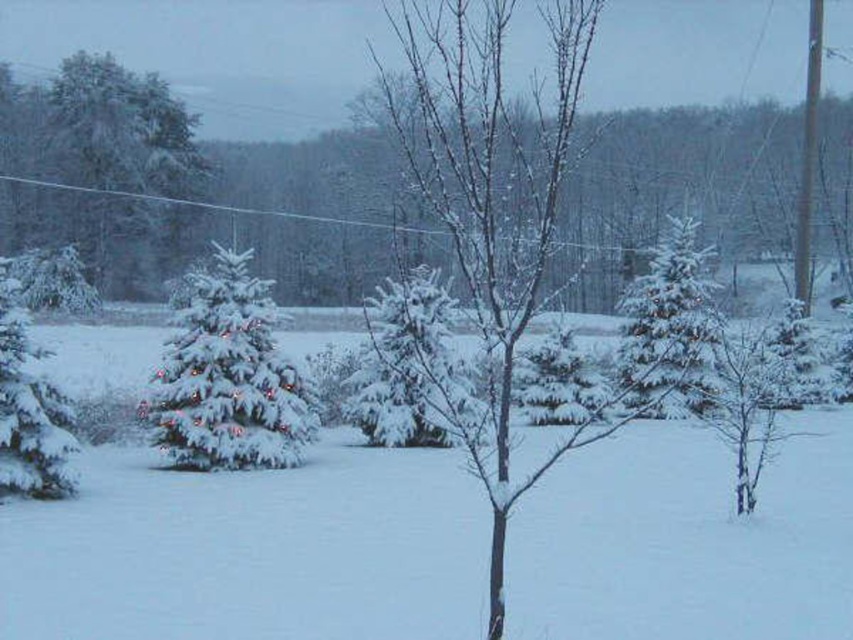
You are standing in the winter scene and want to find the green matte evergreen at upper left. Which direction should you look relative to the green matte evergreen at left?

The green matte evergreen at upper left is to the left of the green matte evergreen at left, so you should look to the left of the green matte evergreen at left to find it.

You are a landscape architect planning to place a new bench in this winter scene. The bench requires a space of 10 meters between the white frosty pine at center and the green matte evergreen at left to ensure enough room for visitors to walk comfortably. Can the existing spacing accommodate this requirement?

The white frosty pine at center and green matte evergreen at left are 12.65 meters apart, which exceeds the required 10 meters. Therefore, the existing spacing can accommodate the bench and provide sufficient walking space for visitors.